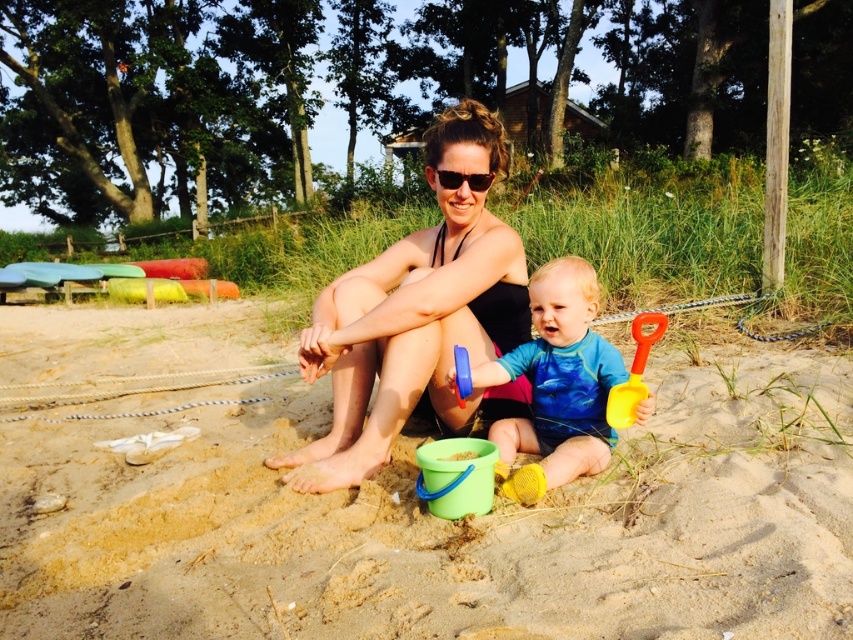
Consider the image. You are a lifeguard standing at the edge of the beach. You need to retrieve the green plastic bucket at center and the black matte swimsuit at center for safety inspection. What is the minimum distance you need to walk to collect both items?

The minimum distance you need to walk to collect both items is 27.77 inches, which is the distance between the green plastic bucket at center and the black matte swimsuit at center.

You are standing at the position of the wooden cabin in the background and want to take a photo of both the point at coordinates point [15,436] and point [410,368]. Which point will appear closer to the camera in the photo?

Point [15,436] is further to the camera than point [410,368], so in the photo, point [15,436] will appear closer to the camera than point [410,368].